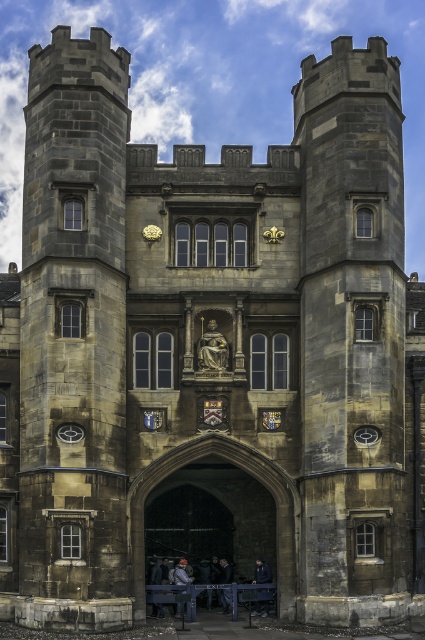
You are a visitor standing in front of the stone archway at center and the wooden park bench at lower center. Which object is taller?

The stone archway at center is taller than the wooden park bench at lower center.

You are standing in front of the medieval stone building and want to determine the relative positions of two points marked on the structure. The first point is at coordinates point (286, 604) and the second is at point (373, 435). Which point appears closer to you when observing the building from the front?

Point (286, 604) is further to the viewer than point (373, 435), so the second point appears closer to you.

You are standing in front of the grand medieval stone building. The statue above the main entrance is positioned in a niche. Where is the stone archway at center located in relation to the statue?

The stone archway at center is located at the main entrance below the statue, as the statue is positioned above the archway in the niche.